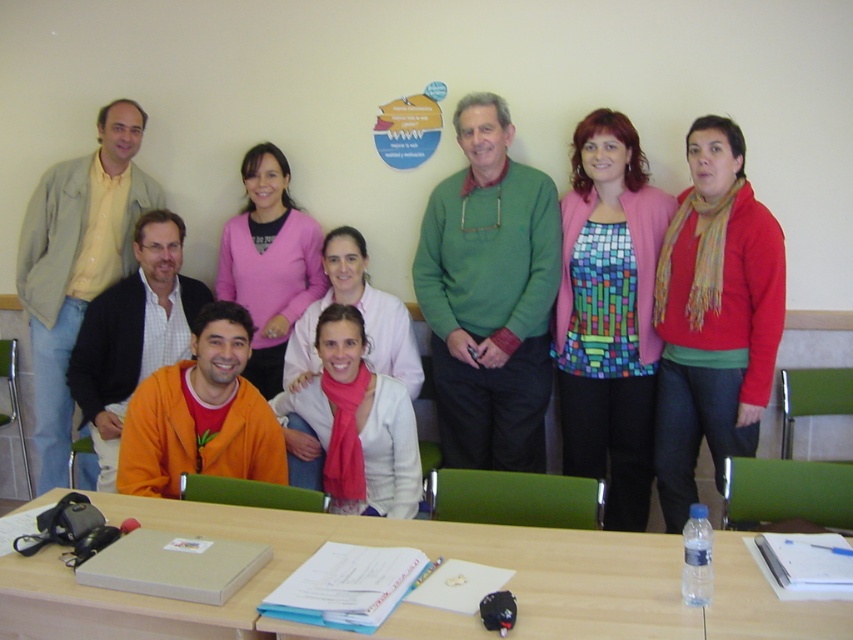
Question: Is wooden table at center behind pink matte sweater at center?

Choices:
 (A) yes
 (B) no

Answer: (B)

Question: Which object is positioned closest to the orange sweater at lower left?

Choices:
 (A) orange matte jacket at lower left
 (B) pink matte sweater at center

Answer: (B)

Question: Which object is positioned farthest from the pink scarf at center?

Choices:
 (A) pink matte sweater at center
 (B) orange matte jacket at lower left
 (C) pink fabric scarf at center
 (D) multicolored mosaic shirt at center

Answer: (D)

Question: Which point is farther to the camera?

Choices:
 (A) (514, 220)
 (B) (264, 374)

Answer: (B)

Question: Is green sweater at center further to the viewer compared to orange sweater at lower left?

Choices:
 (A) yes
 (B) no

Answer: (A)

Question: Does green sweater at center have a greater width compared to pink scarf at center?

Choices:
 (A) yes
 (B) no

Answer: (B)